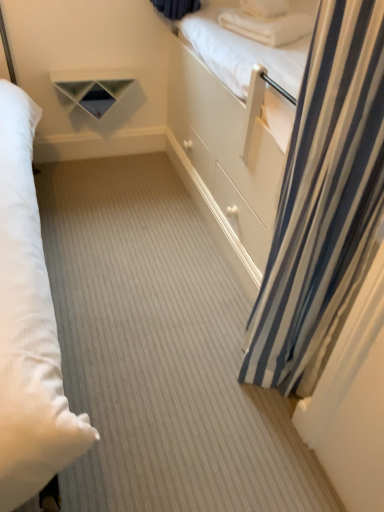
The height and width of the screenshot is (512, 384). Find the location of `free spot in front of white soft pillow at upper right, acting as the first pillow starting from the top`. free spot in front of white soft pillow at upper right, acting as the first pillow starting from the top is located at coordinates (270, 23).